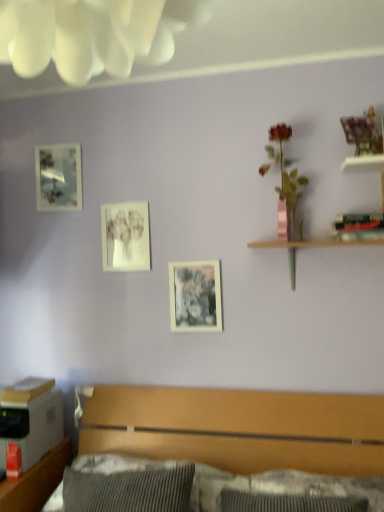
Question: Is matte paper picture frame at center, which is the 2th picture frame from left to right, in front of or behind pink metallic vase at upper right in the image?

Choices:
 (A) behind
 (B) front

Answer: (A)

Question: In the image, is matte paper picture frame at center, which is the 2th picture frame from left to right, on the left side or the right side of pink metallic vase at upper right?

Choices:
 (A) left
 (B) right

Answer: (A)

Question: Based on their relative distances, which object is farther from the matte paper picture frame at center, which is the 2th picture frame from left to right?

Choices:
 (A) wooden shelf at upper right
 (B) pink metallic vase at upper right
 (C) black matte picture frame at center, the 3th picture frame when ordered from left to right
 (D) matte black picture frame at upper left, which ranks as the 3th picture frame in bottom-to-top order
 (E) wooden bed at lower center

Answer: (E)

Question: Considering the real-world distances, which object is farthest from the matte paper picture frame at center, which is counted as the 2th picture frame, starting from the bottom?

Choices:
 (A) black matte picture frame at center, the 3th picture frame when ordered from left to right
 (B) brushed wood dresser at lower left
 (C) matte black picture frame at upper left, marked as the first picture frame in a left-to-right arrangement
 (D) wooden shelf at upper right
 (E) wooden bed at lower center

Answer: (B)